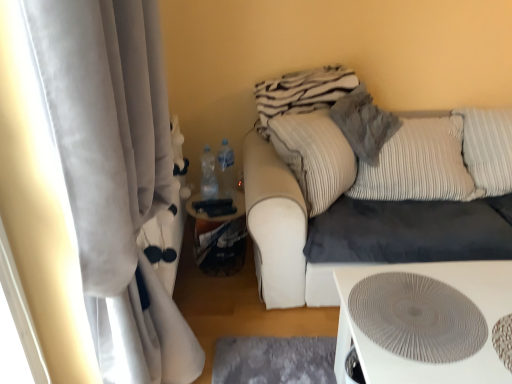
Question: From a real-world perspective, does white velvet curtain at left sit lower than textured gray pillow at upper right, the first pillow from the left?

Choices:
 (A) no
 (B) yes

Answer: (B)

Question: Is white velvet curtain at left positioned before textured gray pillow at upper right, which is counted as the 2th pillow, starting from the right?

Choices:
 (A) no
 (B) yes

Answer: (B)

Question: Is the position of white velvet curtain at left more distant than that of textured gray pillow at upper right, which is counted as the 2th pillow, starting from the right?

Choices:
 (A) no
 (B) yes

Answer: (A)

Question: Is white velvet curtain at left far from textured gray pillow at upper right, which is counted as the 2th pillow, starting from the right?

Choices:
 (A) no
 (B) yes

Answer: (B)

Question: Considering the relative sizes of white velvet curtain at left and textured gray pillow at upper right, which is counted as the 2th pillow, starting from the right, in the image provided, is white velvet curtain at left shorter than textured gray pillow at upper right, which is counted as the 2th pillow, starting from the right,?

Choices:
 (A) no
 (B) yes

Answer: (A)

Question: Considering the relative sizes of white velvet curtain at left and textured gray pillow at upper right, the first pillow from the left, in the image provided, is white velvet curtain at left thinner than textured gray pillow at upper right, the first pillow from the left,?

Choices:
 (A) no
 (B) yes

Answer: (B)

Question: Are velvet beige couch at center and white velvet curtain at left far apart?

Choices:
 (A) no
 (B) yes

Answer: (B)

Question: Does velvet beige couch at center have a greater height compared to white velvet curtain at left?

Choices:
 (A) no
 (B) yes

Answer: (A)

Question: Is white velvet curtain at left at the back of velvet beige couch at center?

Choices:
 (A) no
 (B) yes

Answer: (A)

Question: From a real-world perspective, is velvet beige couch at center physically below white velvet curtain at left?

Choices:
 (A) no
 (B) yes

Answer: (B)

Question: Can you confirm if velvet beige couch at center is bigger than white velvet curtain at left?

Choices:
 (A) yes
 (B) no

Answer: (A)

Question: Is the surface of velvet beige couch at center in direct contact with white velvet curtain at left?

Choices:
 (A) yes
 (B) no

Answer: (B)

Question: Is textured gray pillow at upper right, the first pillow from the left, further to the viewer compared to white textured table at lower right?

Choices:
 (A) yes
 (B) no

Answer: (A)